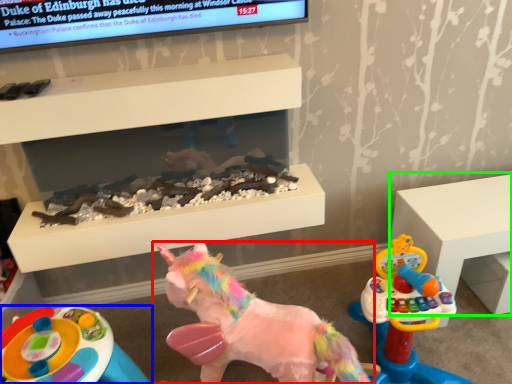
Question: Which object is the closest to the toy (highlighted by a red box)? Choose among these: toy (highlighted by a blue box) or furniture (highlighted by a green box).

Choices:
 (A) toy
 (B) furniture

Answer: (A)